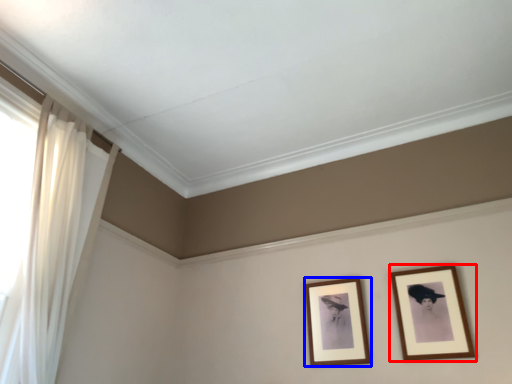
Question: Which of the following is the closest to the observer, picture frame (highlighted by a red box) or picture frame (highlighted by a blue box)?

Choices:
 (A) picture frame
 (B) picture frame

Answer: (A)